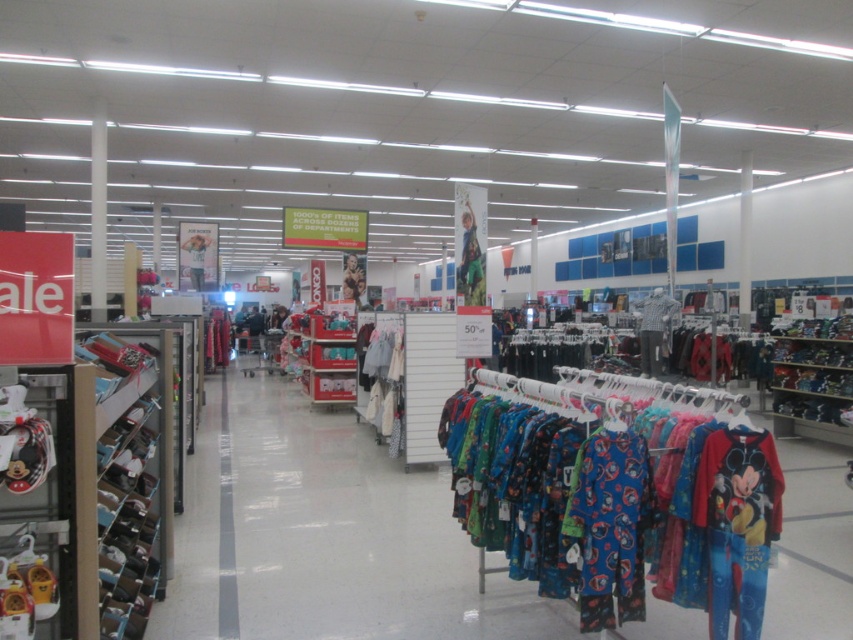
You are a store employee who needs to place a new sign between the blue cotton pajamas at center and the metallic mickey mouse ears at left. The sign requires 2 meters of space to be placed. Is there enough space between them for the sign?

The blue cotton pajamas at center is 1.98 meters from metallic mickey mouse ears at left. Since the required space is 2 meters, there is not enough space between them to place the sign.

You are a customer in the store and want to locate the blue cotton pajamas at center. According to the store layout, where should you look in relation to the childrens pajamas rack on the right?

The blue cotton pajamas at center are located at point 0.725 on the y axis and 0.772 on the x axis, which is to the left of the childrens pajamas rack on the right.